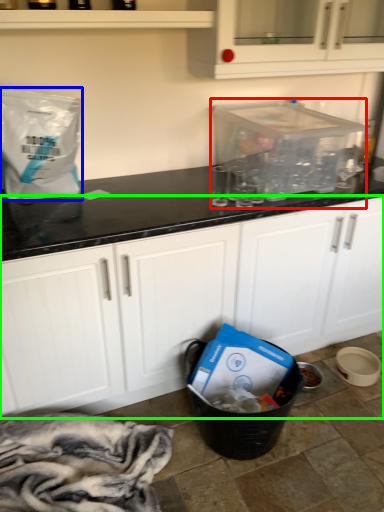
Question: Estimate the real-world distances between objects in this image. Which object is farther from appliance (highlighted by a red box), paper bag (highlighted by a blue box) or cabinetry (highlighted by a green box)?

Choices:
 (A) paper bag
 (B) cabinetry

Answer: (A)